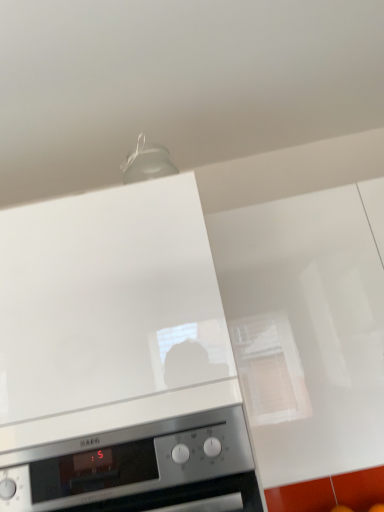
Question: Considering the positions of satin silver oven at lower center, the 1th home appliance from the bottom, and white glossy range hood at upper center, which is the 1th home appliance from top to bottom, in the image, is satin silver oven at lower center, the 1th home appliance from the bottom, bigger or smaller than white glossy range hood at upper center, which is the 1th home appliance from top to bottom,?

Choices:
 (A) big
 (B) small

Answer: (B)

Question: From a real-world perspective, is satin silver oven at lower center, the 1th home appliance from the bottom, positioned above or below white glossy range hood at upper center, which is the 1th home appliance from top to bottom?

Choices:
 (A) above
 (B) below

Answer: (B)

Question: Visually, is satin silver oven at lower center, which is the second home appliance from top to bottom, positioned to the left or to the right of white glossy range hood at upper center, which is the 1th home appliance from top to bottom?

Choices:
 (A) right
 (B) left

Answer: (A)

Question: Is point (14, 227) positioned closer to the camera than point (243, 504)?

Choices:
 (A) closer
 (B) farther

Answer: (B)

Question: Is white glossy range hood at upper center, the second home appliance positioned from the bottom, taller or shorter than satin silver oven at lower center, which is the second home appliance from top to bottom?

Choices:
 (A) short
 (B) tall

Answer: (B)

Question: Is white glossy range hood at upper center, the second home appliance positioned from the bottom, situated inside satin silver oven at lower center, the 1th home appliance from the bottom, or outside?

Choices:
 (A) inside
 (B) outside

Answer: (B)

Question: Is white glossy range hood at upper center, which is the 1th home appliance from top to bottom, wider or thinner than satin silver oven at lower center, the 1th home appliance from the bottom?

Choices:
 (A) wide
 (B) thin

Answer: (A)